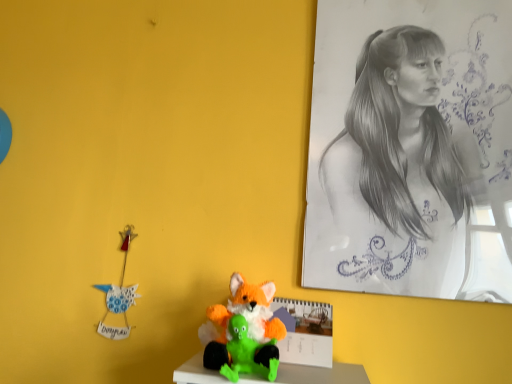
Describe the element at coordinates (244, 316) in the screenshot. I see `fluffy orange and green plush toy at center, which is counted as the second toy, starting from the front` at that location.

In order to click on graphite sketch at upper right in this screenshot , I will do `click(398, 175)`.

Which is behind, point (270, 379) or point (435, 175)?

Positioned behind is point (435, 175).

Is fluffy orange fox at center, which is counted as the first toy, starting from the front, oriented towards graphite sketch at upper right?

No, fluffy orange fox at center, which is counted as the first toy, starting from the front, is not turned towards graphite sketch at upper right.

Considering the relative sizes of fluffy orange fox at center, which is counted as the first toy, starting from the front, and graphite sketch at upper right in the image provided, is fluffy orange fox at center, which is counted as the first toy, starting from the front, thinner than graphite sketch at upper right?

In fact, fluffy orange fox at center, which is counted as the first toy, starting from the front, might be wider than graphite sketch at upper right.

Is graphite sketch at upper right to the left or to the right of fluffy orange fox at center, placed as the second toy when sorted from back to front, in the image?

From the image, it's evident that graphite sketch at upper right is to the right of fluffy orange fox at center, placed as the second toy when sorted from back to front.

Is graphite sketch at upper right spatially inside fluffy orange fox at center, placed as the second toy when sorted from back to front, or outside of it?

graphite sketch at upper right is outside fluffy orange fox at center, placed as the second toy when sorted from back to front.

From the image's perspective, which object appears higher, graphite sketch at upper right or fluffy orange fox at center, which is counted as the first toy, starting from the front?

graphite sketch at upper right is shown above in the image.

Considering the positions of point (265, 314) and point (239, 328), is point (265, 314) closer or farther from the camera than point (239, 328)?

Point (265, 314).

From the image's perspective, relative to fluffy orange fox at center, placed as the second toy when sorted from back to front, is fluffy orange and green plush toy at center, which is counted as the second toy, starting from the front, above or below?

From the image's perspective, fluffy orange and green plush toy at center, which is counted as the second toy, starting from the front, appears above fluffy orange fox at center, placed as the second toy when sorted from back to front.

Is fluffy orange and green plush toy at center, which is counted as the second toy, starting from the front, placed right next to fluffy orange fox at center, placed as the second toy when sorted from back to front?

Yes, fluffy orange and green plush toy at center, which is counted as the second toy, starting from the front, is with fluffy orange fox at center, placed as the second toy when sorted from back to front.

From a real-world perspective, between fluffy orange and green plush toy at center, which is counted as the second toy, starting from the front, and fluffy orange fox at center, placed as the second toy when sorted from back to front, who is vertically lower?

fluffy orange fox at center, placed as the second toy when sorted from back to front, from a real-world perspective.

Considering the points (252, 363) and (266, 304), which point is behind, point (252, 363) or point (266, 304)?

Point (266, 304)

Considering the positions of objects fluffy orange fox at center, which is counted as the first toy, starting from the front, and fluffy orange and green plush toy at center, which ranks as the first toy in back-to-front order, in the image provided, who is more to the right, fluffy orange fox at center, which is counted as the first toy, starting from the front, or fluffy orange and green plush toy at center, which ranks as the first toy in back-to-front order,?

Positioned to the right is fluffy orange fox at center, which is counted as the first toy, starting from the front.

Considering the sizes of objects fluffy orange fox at center, which is counted as the first toy, starting from the front, and fluffy orange and green plush toy at center, which is counted as the second toy, starting from the front, in the image provided, who is smaller, fluffy orange fox at center, which is counted as the first toy, starting from the front, or fluffy orange and green plush toy at center, which is counted as the second toy, starting from the front,?

fluffy orange fox at center, which is counted as the first toy, starting from the front.

Is graphite sketch at upper right wider or thinner than fluffy orange and green plush toy at center, which ranks as the first toy in back-to-front order?

Clearly, graphite sketch at upper right has less width compared to fluffy orange and green plush toy at center, which ranks as the first toy in back-to-front order.

Is graphite sketch at upper right beside fluffy orange and green plush toy at center, which is counted as the second toy, starting from the front?

No, graphite sketch at upper right is not touching fluffy orange and green plush toy at center, which is counted as the second toy, starting from the front.

Which of these two, graphite sketch at upper right or fluffy orange and green plush toy at center, which ranks as the first toy in back-to-front order, is bigger?

With larger size is graphite sketch at upper right.

Starting from the graphite sketch at upper right, which toy is the 1st one in front? Please provide its 2D coordinates.

[(244, 316)]

In the image, is fluffy orange and green plush toy at center, which is counted as the second toy, starting from the front, positioned in front of or behind graphite sketch at upper right?

fluffy orange and green plush toy at center, which is counted as the second toy, starting from the front, is positioned closer to the viewer than graphite sketch at upper right.

Does fluffy orange and green plush toy at center, which ranks as the first toy in back-to-front order, have a lesser width compared to graphite sketch at upper right?

In fact, fluffy orange and green plush toy at center, which ranks as the first toy in back-to-front order, might be wider than graphite sketch at upper right.

From the image's perspective, is fluffy orange and green plush toy at center, which is counted as the second toy, starting from the front, located above or below graphite sketch at upper right?

Result: Clearly, from the image's perspective, fluffy orange and green plush toy at center, which is counted as the second toy, starting from the front, is below graphite sketch at upper right.

This screenshot has height=384, width=512. Identify the location of the 2nd toy in front of the graphite sketch at upper right, starting your count from the anchor. (246, 353).

Find the location of a particular element. woman above the fluffy orange fox at center, placed as the second toy when sorted from back to front (from the image's perspective) is located at coordinates (398, 175).

From the image, which object appears to be nearer to fluffy orange and green plush toy at center, which is counted as the second toy, starting from the front, graphite sketch at upper right or fluffy orange fox at center, which is counted as the first toy, starting from the front?

The object closer to fluffy orange and green plush toy at center, which is counted as the second toy, starting from the front, is fluffy orange fox at center, which is counted as the first toy, starting from the front.

Considering their positions, is fluffy orange fox at center, placed as the second toy when sorted from back to front, positioned closer to fluffy orange and green plush toy at center, which is counted as the second toy, starting from the front, than graphite sketch at upper right?

Based on the image, fluffy orange fox at center, placed as the second toy when sorted from back to front, appears to be nearer to fluffy orange and green plush toy at center, which is counted as the second toy, starting from the front.

Which object lies nearer to the anchor point fluffy orange fox at center, which is counted as the first toy, starting from the front, graphite sketch at upper right or fluffy orange and green plush toy at center, which is counted as the second toy, starting from the front?

fluffy orange and green plush toy at center, which is counted as the second toy, starting from the front.

Which object lies nearer to the anchor point graphite sketch at upper right, fluffy orange fox at center, which is counted as the first toy, starting from the front, or fluffy orange and green plush toy at center, which ranks as the first toy in back-to-front order?

fluffy orange and green plush toy at center, which ranks as the first toy in back-to-front order, is closer to graphite sketch at upper right.

Based on their spatial positions, is fluffy orange and green plush toy at center, which ranks as the first toy in back-to-front order, or fluffy orange fox at center, placed as the second toy when sorted from back to front, closer to graphite sketch at upper right?

The object closer to graphite sketch at upper right is fluffy orange and green plush toy at center, which ranks as the first toy in back-to-front order.

Estimate the real-world distances between objects in this image. Which object is further from fluffy orange fox at center, placed as the second toy when sorted from back to front, fluffy orange and green plush toy at center, which is counted as the second toy, starting from the front, or graphite sketch at upper right?

graphite sketch at upper right is positioned further to the anchor fluffy orange fox at center, placed as the second toy when sorted from back to front.

Where is `toy between graphite sketch at upper right and fluffy orange fox at center, which is counted as the first toy, starting from the front, from top to bottom`? This screenshot has width=512, height=384. toy between graphite sketch at upper right and fluffy orange fox at center, which is counted as the first toy, starting from the front, from top to bottom is located at coordinates (244, 316).